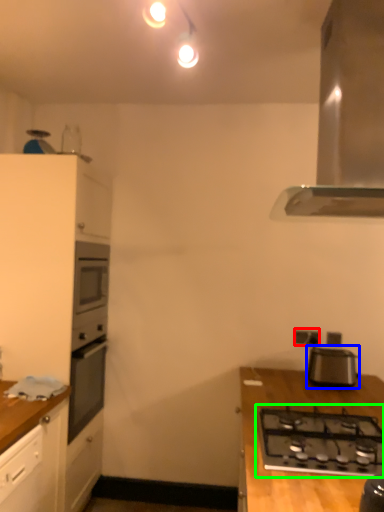
Question: Considering the real-world distances, which object is farthest from electric outlet (highlighted by a red box)? appliance (highlighted by a blue box) or gas stove (highlighted by a green box)?

Choices:
 (A) appliance
 (B) gas stove

Answer: (B)